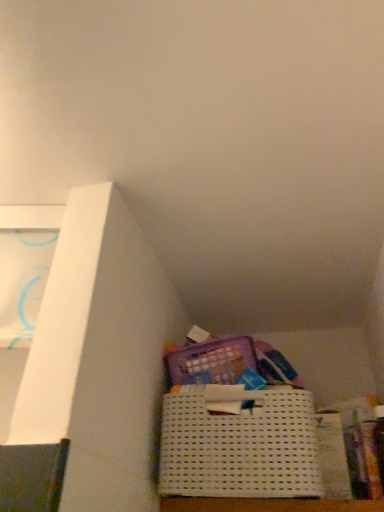
Question: Is white paper at lower right positioned beyond the bounds of white woven basket at lower center?

Choices:
 (A) yes
 (B) no

Answer: (A)

Question: Could you tell me if white paper at lower right is facing white woven basket at lower center?

Choices:
 (A) no
 (B) yes

Answer: (A)

Question: Is white paper at lower right bigger than white woven basket at lower center?

Choices:
 (A) no
 (B) yes

Answer: (A)

Question: Is white paper at lower right placed right next to white woven basket at lower center?

Choices:
 (A) no
 (B) yes

Answer: (A)

Question: Considering the relative sizes of white paper at lower right and white woven basket at lower center in the image provided, is white paper at lower right taller than white woven basket at lower center?

Choices:
 (A) no
 (B) yes

Answer: (B)

Question: From a real-world perspective, is white paper at lower right positioned over white woven basket at lower center based on gravity?

Choices:
 (A) no
 (B) yes

Answer: (A)

Question: From the image's perspective, is white woven basket at lower center on white paper at lower right?

Choices:
 (A) no
 (B) yes

Answer: (B)

Question: Does white woven basket at lower center have a greater height compared to white paper at lower right?

Choices:
 (A) yes
 (B) no

Answer: (B)

Question: Is white woven basket at lower center smaller than white paper at lower right?

Choices:
 (A) no
 (B) yes

Answer: (A)

Question: Does white woven basket at lower center come in front of white paper at lower right?

Choices:
 (A) no
 (B) yes

Answer: (B)

Question: Does white woven basket at lower center touch white paper at lower right?

Choices:
 (A) no
 (B) yes

Answer: (A)

Question: Does white woven basket at lower center lie behind white paper at lower right?

Choices:
 (A) yes
 (B) no

Answer: (B)

Question: In the image, is white paper at lower right on the left side or the right side of white woven basket at lower center?

Choices:
 (A) right
 (B) left

Answer: (A)